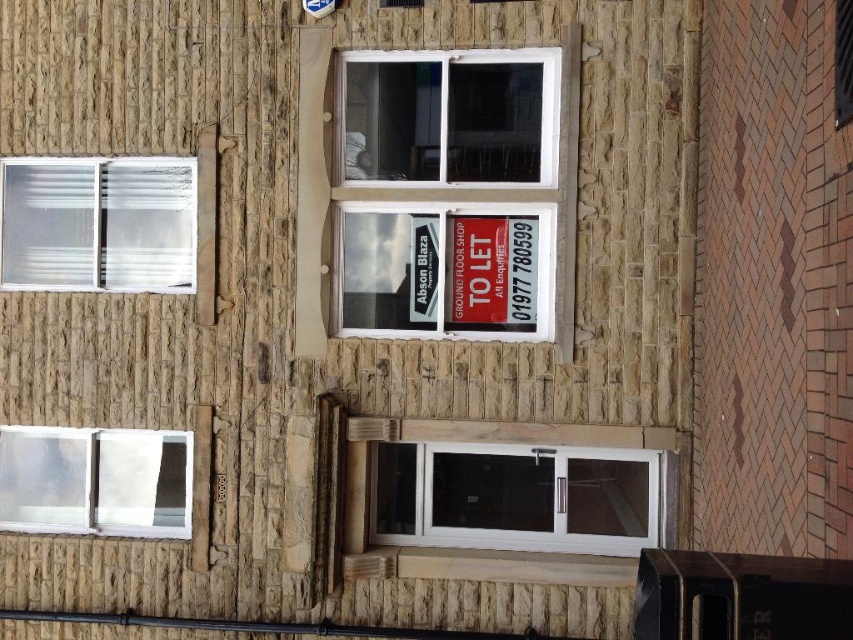
Question: Is the position of transparent plastic window at upper left more distant than that of transparent plastic window at lower left?

Choices:
 (A) yes
 (B) no

Answer: (B)

Question: Is white plastic window at center bigger than white glass door at lower center?

Choices:
 (A) no
 (B) yes

Answer: (B)

Question: Which object is the farthest from the transparent plastic window at lower left?

Choices:
 (A) white plastic window at center
 (B) transparent plastic window at upper left

Answer: (A)

Question: Can you confirm if transparent plastic window at upper left is bigger than transparent plastic window at lower left?

Choices:
 (A) yes
 (B) no

Answer: (A)

Question: Which object is the farthest from the transparent plastic window at lower left?

Choices:
 (A) white glass door at lower center
 (B) white plastic window at center
 (C) transparent plastic window at upper left

Answer: (B)

Question: Considering the real-world distances, which object is farthest from the white glass door at lower center?

Choices:
 (A) transparent plastic window at lower left
 (B) transparent plastic window at upper left
 (C) white plastic window at center

Answer: (B)